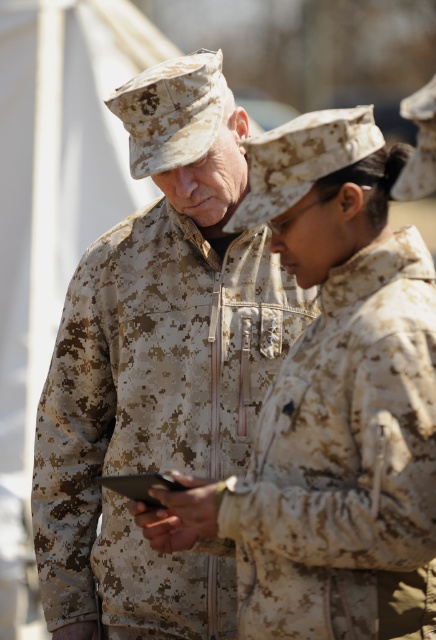
You are a photographer who wants to adjust the lighting to highlight the camouflage uniform at center and the camouflage fabric jacket at center. Since the background is blurred, which object should you focus on to ensure both are visible?

The camouflage fabric jacket at center is behind the camouflage uniform at center. To ensure both are visible, focus on the camouflage uniform at center since it is closer to the camera, and the jacket behind it may be slightly out of focus due to the shallow depth of field.

You are a drone operator controlling a drone that needs to fly from point A to point B. Point A is at coordinates point (98, 369) and point B is at coordinates point (343, 532). According to the image, is point A located behind point B from the observer perspective?

Yes, point (98, 369) is behind point (343, 532) from the observer perspective.